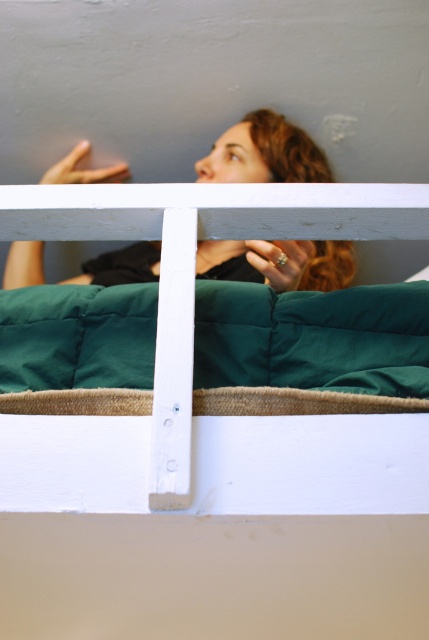
You are an interior designer assessing the space in the bedroom. You need to place a decorative item between the green quilted fabric at upper center and the matte black hair at upper center. Considering their widths, which object should the item be placed closer to?

The decorative item should be placed closer to the matte black hair at upper center because the green quilted fabric at upper center has a smaller width compared to the matte black hair at upper center.